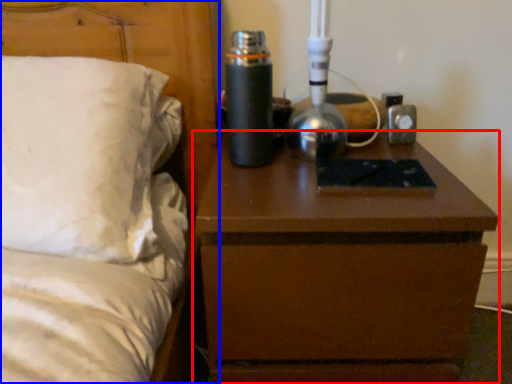
Question: Which object appears farthest to the camera in this image, nightstand (highlighted by a red box) or bed (highlighted by a blue box)?

Choices:
 (A) nightstand
 (B) bed

Answer: (A)